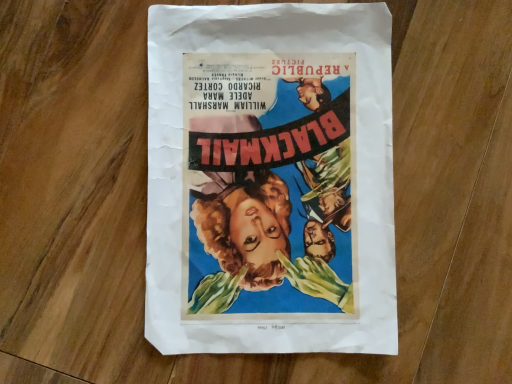
Question: Should I look upward or downward to see matte paper poster at center?

Choices:
 (A) down
 (B) up

Answer: (B)